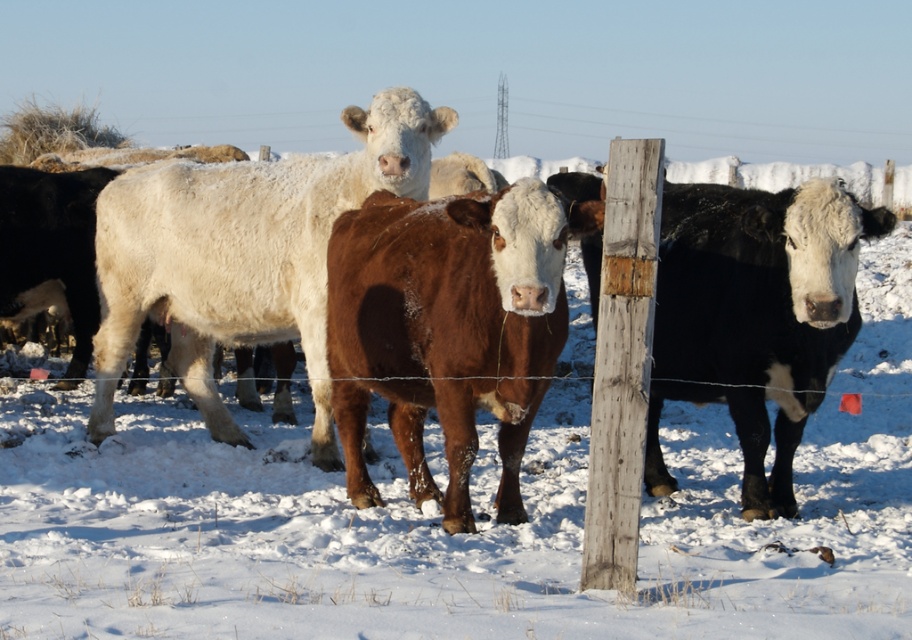
Between point (434, 276) and point (729, 390), which one is positioned behind?

The point (729, 390) is more distant.

The height and width of the screenshot is (640, 912). Describe the element at coordinates (448, 328) in the screenshot. I see `brown matte cow at center` at that location.

Locate an element on the screen. brown matte cow at center is located at coordinates (448, 328).

Which is more to the left, white woolly bull at center or black smooth cow at right?

From the viewer's perspective, white woolly bull at center appears more on the left side.

Between point (299, 211) and point (747, 204), which one is positioned behind?

The point (299, 211) is behind.

I want to click on white woolly bull at center, so click(244, 253).

Is the position of brown matte cow at center more distant than that of white woolly bull at center?

No.

This screenshot has width=912, height=640. Describe the element at coordinates (448, 328) in the screenshot. I see `brown matte cow at center` at that location.

Where is `brown matte cow at center`? The height and width of the screenshot is (640, 912). brown matte cow at center is located at coordinates pos(448,328).